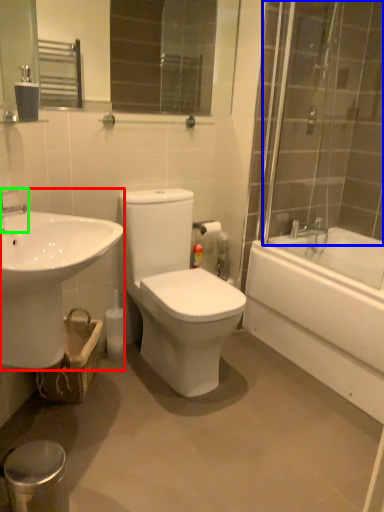
Question: Considering the real-world distances, which object is farthest from sink (highlighted by a red box)? shower door (highlighted by a blue box) or tap (highlighted by a green box)?

Choices:
 (A) shower door
 (B) tap

Answer: (A)